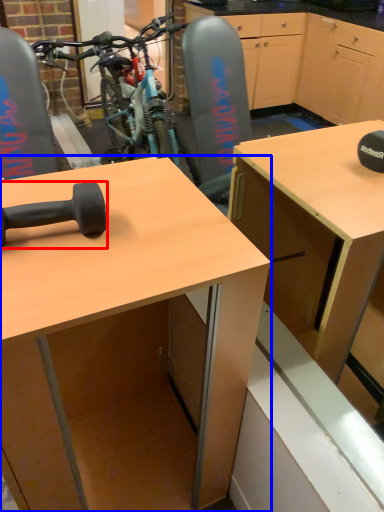
Question: Among these objects, which one is nearest to the camera, dumbbell (highlighted by a red box) or desk (highlighted by a blue box)?

Choices:
 (A) dumbbell
 (B) desk

Answer: (B)